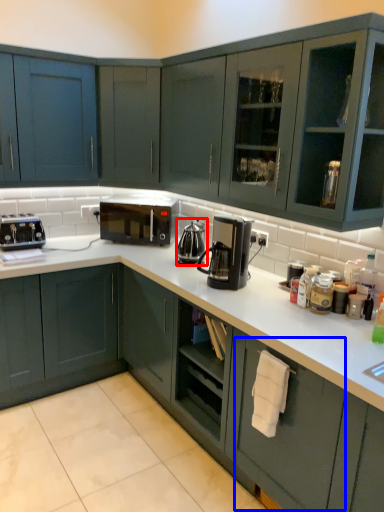
Question: Among these objects, which one is farthest to the camera, coffeepot (highlighted by a red box) or drawer (highlighted by a blue box)?

Choices:
 (A) coffeepot
 (B) drawer

Answer: (A)